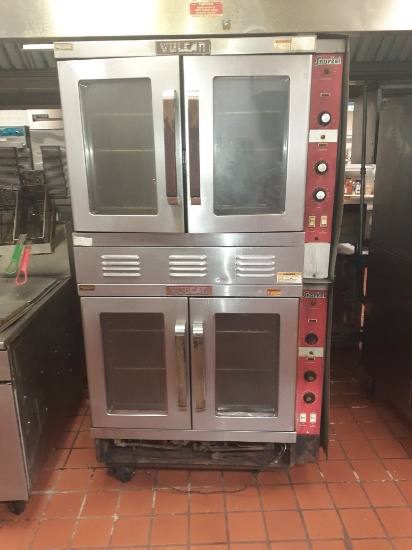
Where is `switches`? switches is located at coordinates (323, 221), (309, 220), (313, 418), (301, 418).